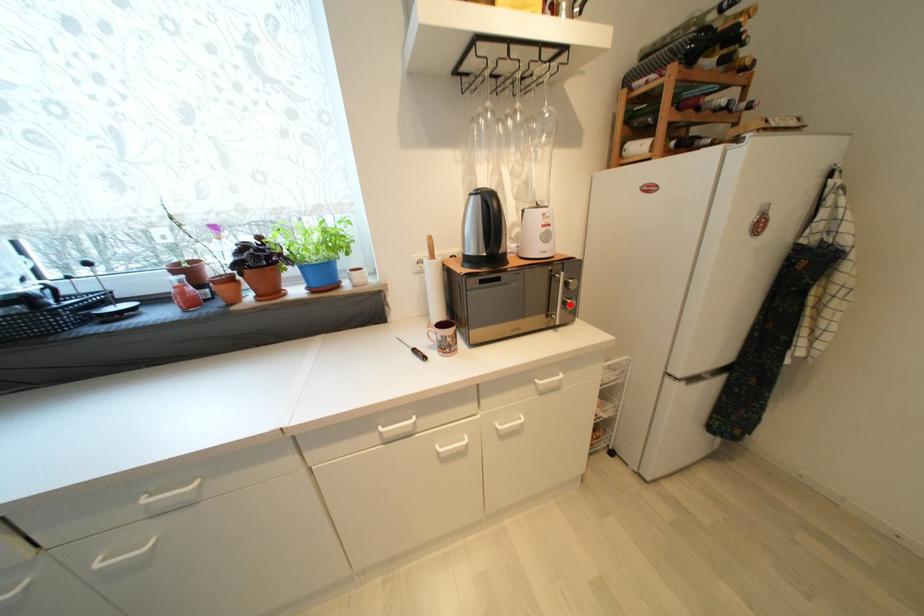
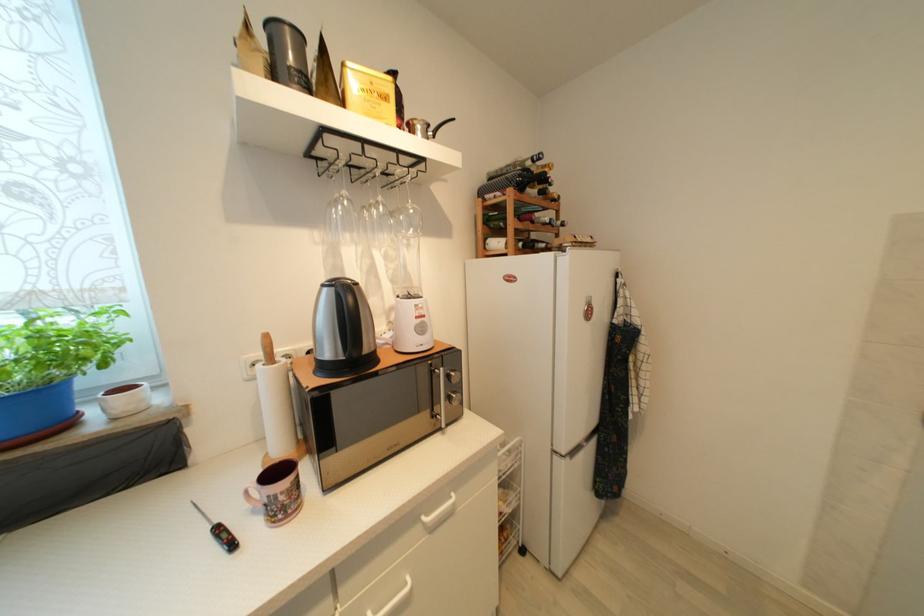
Question: I am providing you with two images of the same scene from different viewpoints. Image1 has a red point marked. In image2, the corresponding 3D location appears at what relative position? Reply with the corresponding letter.

Choices:
 (A) Closer
 (B) Farther

Answer: (B)